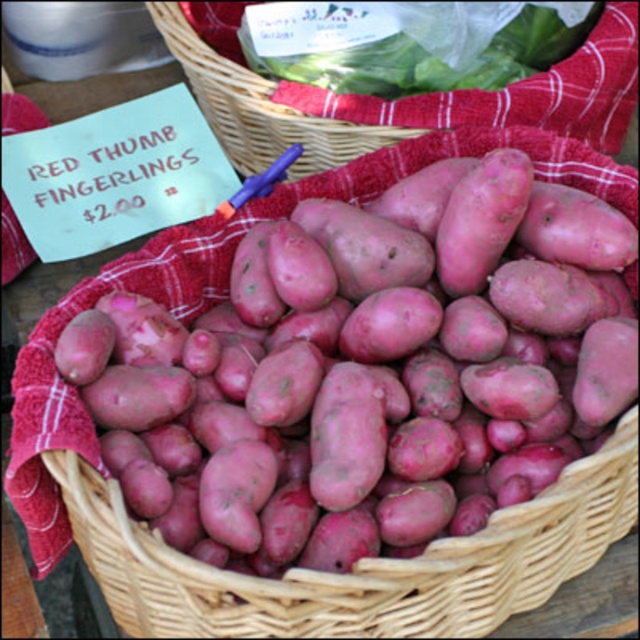
Question: Based on their relative distances, which object is nearer to the smooth green leafy vegetable at upper center?

Choices:
 (A) matte wicker basket at center
 (B) matte red potato at center

Answer: (A)

Question: Is matte wicker basket at center above smooth green leafy vegetable at upper center?

Choices:
 (A) no
 (B) yes

Answer: (A)

Question: Which point is closer to the camera?

Choices:
 (A) (529, 65)
 (B) (284, 538)

Answer: (B)

Question: Is matte red potato at center below matte wicker basket at center?

Choices:
 (A) no
 (B) yes

Answer: (B)

Question: From the image, what is the correct spatial relationship of matte red potato at center in relation to smooth green leafy vegetable at upper center?

Choices:
 (A) below
 (B) above

Answer: (A)

Question: Which is farther from the matte red potato at center?

Choices:
 (A) matte wicker basket at center
 (B) smooth green leafy vegetable at upper center

Answer: (B)